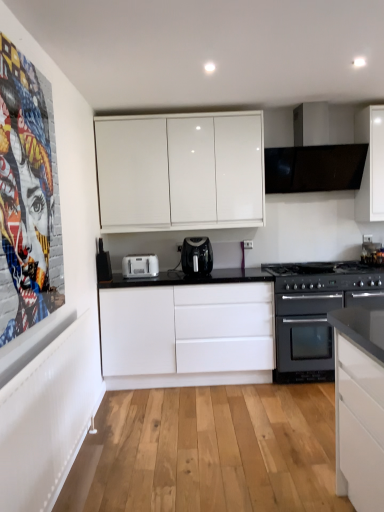
Question: Is white plastic toaster at center wider than black plastic air fryer at center?

Choices:
 (A) yes
 (B) no

Answer: (B)

Question: Can we say white plastic toaster at center lies outside black plastic air fryer at center?

Choices:
 (A) no
 (B) yes

Answer: (B)

Question: Is white plastic toaster at center smaller than black plastic air fryer at center?

Choices:
 (A) yes
 (B) no

Answer: (A)

Question: From a real-world perspective, does white plastic toaster at center sit lower than black plastic air fryer at center?

Choices:
 (A) yes
 (B) no

Answer: (A)

Question: Does white plastic toaster at center appear on the left side of black plastic air fryer at center?

Choices:
 (A) yes
 (B) no

Answer: (A)

Question: Visually, is colorful collage at left positioned to the left or to the right of black matte oven at lower right, the first appliance ordered from the bottom?

Choices:
 (A) right
 (B) left

Answer: (B)

Question: Is colorful collage at left inside the boundaries of black matte oven at lower right, which is the 2th appliance in top-to-bottom order, or outside?

Choices:
 (A) inside
 (B) outside

Answer: (B)

Question: From their relative heights in the image, would you say colorful collage at left is taller or shorter than black matte oven at lower right, which is the 2th appliance in top-to-bottom order?

Choices:
 (A) tall
 (B) short

Answer: (A)

Question: Is point (11, 291) positioned closer to the camera than point (281, 360)?

Choices:
 (A) closer
 (B) farther

Answer: (A)

Question: In the image, is white glossy cabinet at upper center, which is the first cabinetry from top to bottom, positioned in front of or behind colorful collage at left?

Choices:
 (A) front
 (B) behind

Answer: (B)

Question: In terms of width, does white glossy cabinet at upper center, marked as the second cabinetry in a bottom-to-top arrangement, look wider or thinner when compared to colorful collage at left?

Choices:
 (A) wide
 (B) thin

Answer: (A)

Question: From the image's perspective, is white glossy cabinet at upper center, which is the first cabinetry from top to bottom, located above or below colorful collage at left?

Choices:
 (A) below
 (B) above

Answer: (B)

Question: From their relative heights in the image, would you say white glossy cabinet at upper center, which is the first cabinetry from top to bottom, is taller or shorter than colorful collage at left?

Choices:
 (A) tall
 (B) short

Answer: (B)

Question: Considering the positions of black matte oven at lower right, the first appliance ordered from the bottom, and white plastic toaster at center in the image, is black matte oven at lower right, the first appliance ordered from the bottom, taller or shorter than white plastic toaster at center?

Choices:
 (A) short
 (B) tall

Answer: (B)

Question: Is black matte oven at lower right, placed as the 2th appliance when sorted from left to right, wider or thinner than white plastic toaster at center?

Choices:
 (A) thin
 (B) wide

Answer: (B)